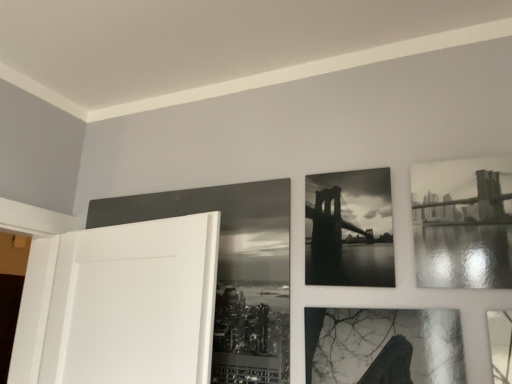
Question: Is black glossy photo frame at center, the 2th picture frame positioned from the right, in front of black glossy picture frame at upper center, placed as the third picture frame when sorted from right to left?

Choices:
 (A) no
 (B) yes

Answer: (B)

Question: Is black glossy photo frame at center, the 2th picture frame positioned from the right, taller than black glossy picture frame at upper center, placed as the third picture frame when sorted from right to left?

Choices:
 (A) no
 (B) yes

Answer: (A)

Question: Can you confirm if black glossy photo frame at center, the 2th picture frame positioned from the right, is wider than black glossy picture frame at upper center, positioned as the first picture frame in left-to-right order?

Choices:
 (A) yes
 (B) no

Answer: (A)

Question: From the image's perspective, would you say black glossy photo frame at center, which is the second picture frame in left-to-right order, is positioned over black glossy picture frame at upper center, positioned as the first picture frame in left-to-right order?

Choices:
 (A) no
 (B) yes

Answer: (B)

Question: Is there a large distance between black glossy photo frame at center, which is the second picture frame in left-to-right order, and black glossy picture frame at upper center, placed as the third picture frame when sorted from right to left?

Choices:
 (A) yes
 (B) no

Answer: (B)

Question: Can black glossy picture frame at upper center, placed as the third picture frame when sorted from right to left, be found inside black glossy photo frame at center, which is the second picture frame in left-to-right order?

Choices:
 (A) yes
 (B) no

Answer: (B)

Question: Can you confirm if black glossy photo frame at upper right, which ranks as the 3th picture frame in left-to-right order, is bigger than black glossy photo frame at center, the 2th picture frame positioned from the right?

Choices:
 (A) no
 (B) yes

Answer: (A)

Question: Is black glossy photo frame at upper right, which ranks as the 3th picture frame in left-to-right order, located outside black glossy photo frame at center, which is the second picture frame in left-to-right order?

Choices:
 (A) no
 (B) yes

Answer: (B)

Question: Is black glossy photo frame at upper right, which ranks as the 3th picture frame in left-to-right order, wider than black glossy photo frame at center, which is the second picture frame in left-to-right order?

Choices:
 (A) yes
 (B) no

Answer: (A)

Question: Is black glossy photo frame at upper right, which is the 1th picture frame in right-to-left order, next to black glossy photo frame at center, the 2th picture frame positioned from the right, and touching it?

Choices:
 (A) yes
 (B) no

Answer: (B)

Question: Is black glossy photo frame at upper right, which ranks as the 3th picture frame in left-to-right order, far away from black glossy photo frame at center, the 2th picture frame positioned from the right?

Choices:
 (A) no
 (B) yes

Answer: (A)

Question: Could black glossy photo frame at center, which is the second picture frame in left-to-right order, be considered to be inside black glossy photo frame at upper right, which ranks as the 3th picture frame in left-to-right order?

Choices:
 (A) yes
 (B) no

Answer: (B)

Question: Can you confirm if black glossy picture frame at upper center, placed as the third picture frame when sorted from right to left, is thinner than black glossy photo frame at center, the 2th picture frame positioned from the right?

Choices:
 (A) yes
 (B) no

Answer: (A)